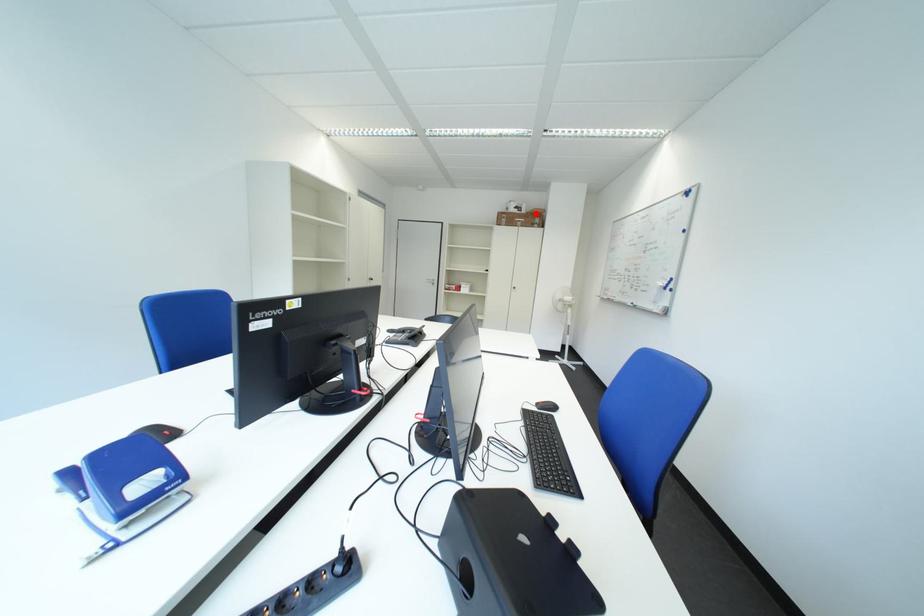
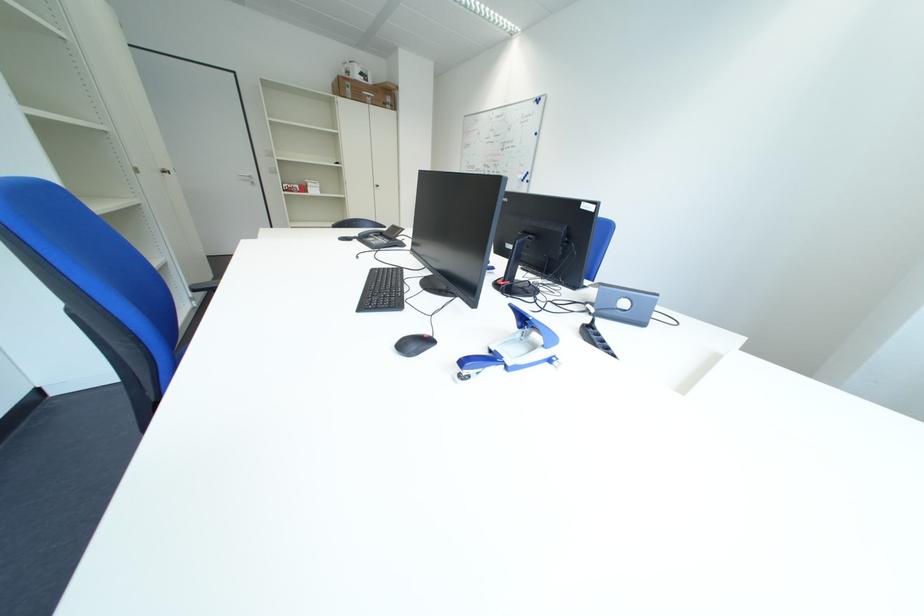
In the second image, find the point that corresponds to the highlighted location in the first image.

(383, 84)